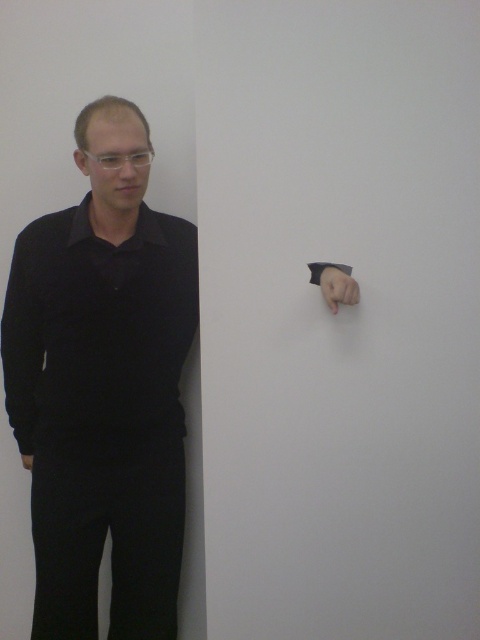
Between black matte shirt at left and matte black hand at upper right, which one appears on the left side from the viewer's perspective?

From the viewer's perspective, black matte shirt at left appears more on the left side.

Is black matte shirt at left positioned at the back of matte black hand at upper right?

Yes, black matte shirt at left is behind matte black hand at upper right.

Between point (153, 337) and point (336, 280), which one is positioned in front?

Positioned in front is point (336, 280).

I want to click on black matte shirt at left, so click(103, 387).

Does black matte shirt at left have a greater width compared to black smooth shirt at left?

Indeed, black matte shirt at left has a greater width compared to black smooth shirt at left.

Which is above, black matte shirt at left or black smooth shirt at left?

black smooth shirt at left is higher up.

Locate an element on the screen. black matte shirt at left is located at coordinates (103, 387).

Does black smooth shirt at left have a larger size compared to matte black hand at upper right?

Indeed, black smooth shirt at left has a larger size compared to matte black hand at upper right.

Who is higher up, black smooth shirt at left or matte black hand at upper right?

Positioned higher is matte black hand at upper right.

Identify the location of black smooth shirt at left. This screenshot has height=640, width=480. (97, 332).

The height and width of the screenshot is (640, 480). I want to click on black smooth shirt at left, so click(x=97, y=332).